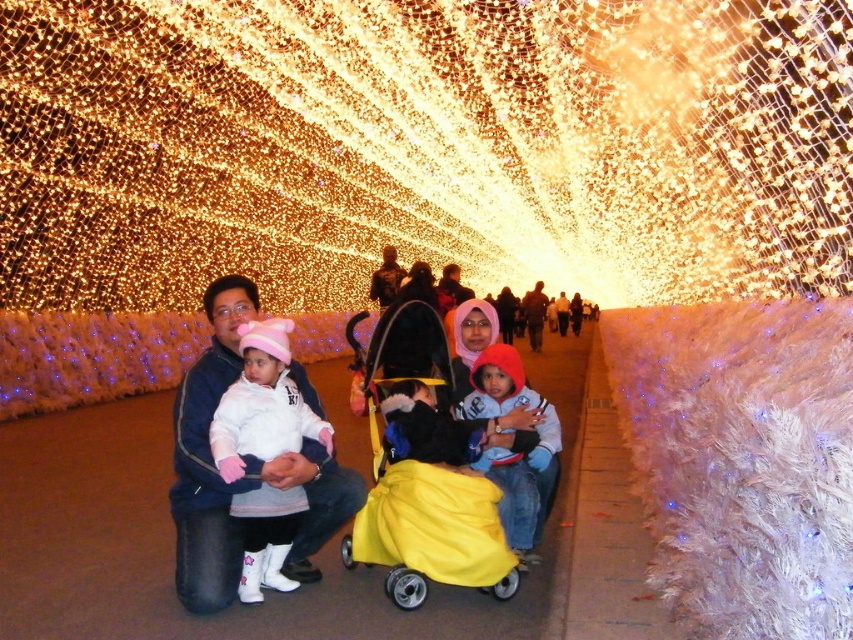
Question: Estimate the real-world distances between objects in this image. Which object is farther from the light blue fleece jacket at center?

Choices:
 (A) dark brown leather jacket at center
 (B) yellow fabric baby carriage at center
 (C) matte black stroller at center
 (D) white fleece jacket at center

Answer: (A)

Question: Does white fleece jacket at center appear over matte pink hoodie at center?

Choices:
 (A) yes
 (B) no

Answer: (B)

Question: Can you confirm if yellow fabric baby carriage at center is positioned below matte black stroller at center?

Choices:
 (A) yes
 (B) no

Answer: (A)

Question: Estimate the real-world distances between objects in this image. Which object is farther from the yellow fabric baby carriage at center?

Choices:
 (A) matte black stroller at center
 (B) matte pink hoodie at center
 (C) dark brown leather jacket at center
 (D) light blue fleece jacket at center

Answer: (B)

Question: Is light blue fleece jacket at center positioned in front of dark brown leather jacket at center?

Choices:
 (A) yes
 (B) no

Answer: (A)

Question: Considering the real-world distances, which object is farthest from the matte black stroller at center?

Choices:
 (A) yellow fabric baby carriage at center
 (B) light blue fleece jacket at center

Answer: (B)